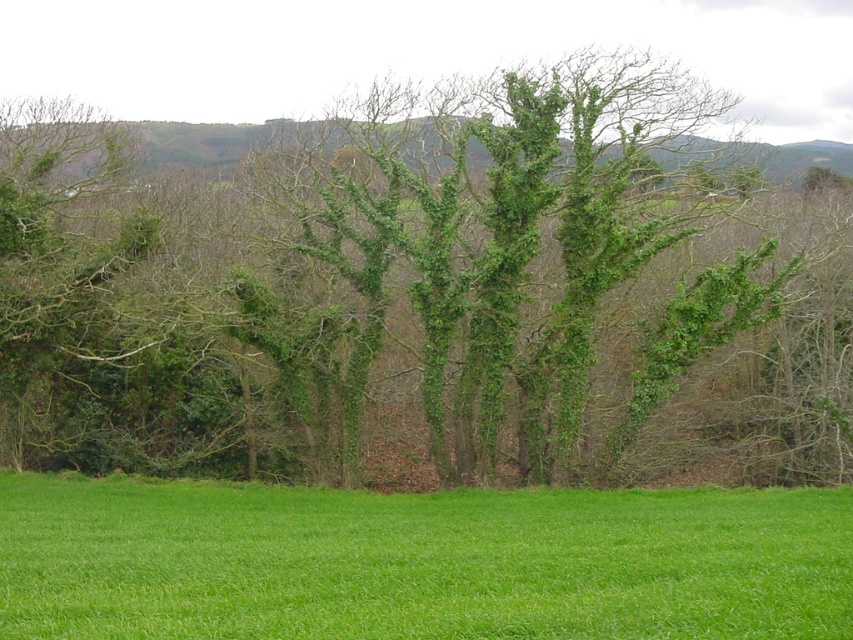
You are standing in the rural landscape and want to walk towards the green leafy tree at center and the green leafy hillside at upper center. Which one will you reach first?

You will reach the green leafy tree at center first because it is closer to the viewer than the green leafy hillside at upper center.

You are a gardener planning to plant flowers in the green grass at center and the green leafy hillside at upper center. Which area has more space available for planting?

The green leafy hillside at upper center has more space available for planting since it is wider than the green grass at center.

You are an environmental scientist assessing the biodiversity of this rural area. You observe the green leafy tree at center and the green leafy hillside at upper center. Which of these two has a smaller width?

The green leafy tree at center has a lesser width compared to the green leafy hillside at upper center.